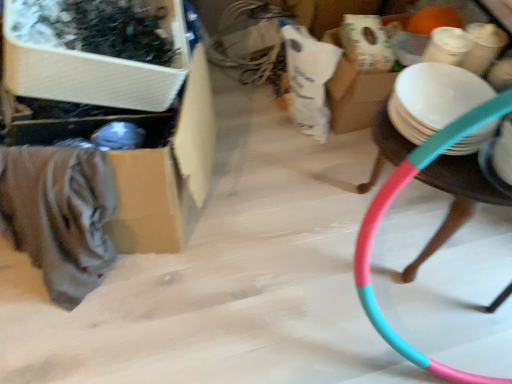
Question: Considering the relative sizes of cardboard box at left, the first storage box in the back-to-front sequence, and pink plastic hoop at right in the image provided, is cardboard box at left, the first storage box in the back-to-front sequence, thinner than pink plastic hoop at right?

Choices:
 (A) no
 (B) yes

Answer: (A)

Question: From the image's perspective, is cardboard box at left, the first storage box in the back-to-front sequence, on top of pink plastic hoop at right?

Choices:
 (A) yes
 (B) no

Answer: (A)

Question: Can we say cardboard box at left, the first storage box in the back-to-front sequence, lies outside pink plastic hoop at right?

Choices:
 (A) no
 (B) yes

Answer: (B)

Question: Is cardboard box at left, which appears as the second storage box when viewed from the front, to the left of pink plastic hoop at right from the viewer's perspective?

Choices:
 (A) no
 (B) yes

Answer: (B)

Question: Can you confirm if cardboard box at left, the first storage box in the back-to-front sequence, is wider than pink plastic hoop at right?

Choices:
 (A) no
 (B) yes

Answer: (B)

Question: Is cardboard box at left, the first storage box in the back-to-front sequence, facing towards pink plastic hoop at right?

Choices:
 (A) yes
 (B) no

Answer: (B)

Question: Does white matte plate at right have a lesser height compared to cardboard box at left, which appears as the second storage box when viewed from the front?

Choices:
 (A) no
 (B) yes

Answer: (B)

Question: Is white matte plate at right thinner than cardboard box at left, which appears as the second storage box when viewed from the front?

Choices:
 (A) yes
 (B) no

Answer: (A)

Question: From the image's perspective, is white matte plate at right over cardboard box at left, which appears as the second storage box when viewed from the front?

Choices:
 (A) no
 (B) yes

Answer: (B)

Question: Is the depth of white matte plate at right greater than that of cardboard box at left, the first storage box in the back-to-front sequence?

Choices:
 (A) yes
 (B) no

Answer: (A)

Question: Considering the relative sizes of white matte plate at right and cardboard box at left, the first storage box in the back-to-front sequence, in the image provided, is white matte plate at right taller than cardboard box at left, the first storage box in the back-to-front sequence,?

Choices:
 (A) yes
 (B) no

Answer: (B)

Question: Can you confirm if white matte plate at right is smaller than cardboard box at left, which appears as the second storage box when viewed from the front?

Choices:
 (A) no
 (B) yes

Answer: (B)

Question: Are pink plastic hoop at right and white matte plate at right located far from each other?

Choices:
 (A) no
 (B) yes

Answer: (A)